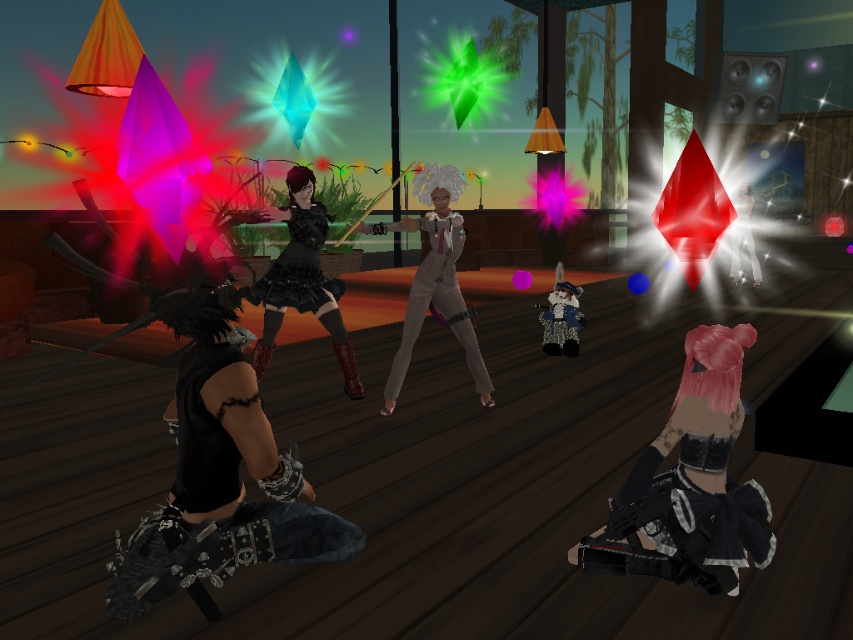
Question: Is black leather jacket at lower right thinner than satin beige suit at center?

Choices:
 (A) yes
 (B) no

Answer: (A)

Question: Can you confirm if matte black skirt at center is positioned below white matte pants at center?

Choices:
 (A) yes
 (B) no

Answer: (A)

Question: Which object appears closest to the camera in this image?

Choices:
 (A) satin beige suit at center
 (B) black leather jacket at lower right
 (C) white matte pants at center

Answer: (B)

Question: Among these points, which one is nearest to the camera?

Choices:
 (A) (706, 577)
 (B) (334, 342)
 (C) (752, 248)

Answer: (A)

Question: Which of the following is the closest to the observer?

Choices:
 (A) satin beige suit at center
 (B) black leather jacket at lower right
 (C) white matte pants at center
 (D) matte black skirt at center

Answer: (B)

Question: Is black leather jacket at lower right thinner than matte black skirt at center?

Choices:
 (A) no
 (B) yes

Answer: (B)